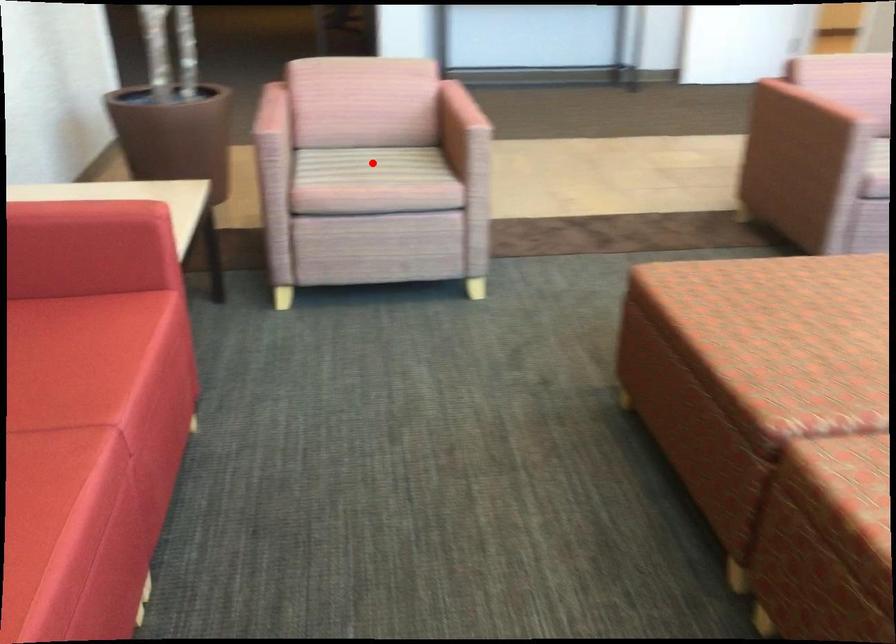
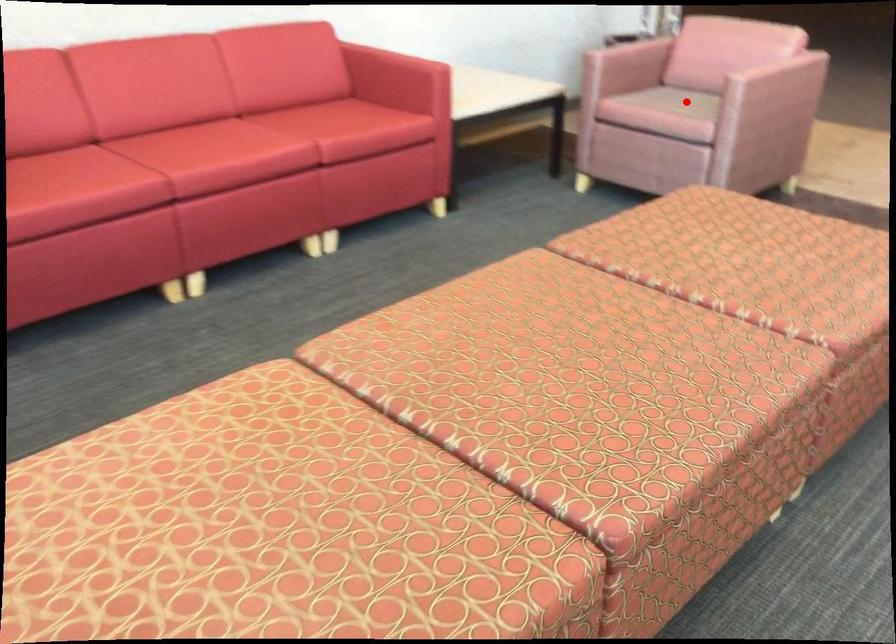
I am providing you with two images of the same scene from different viewpoints. A red point is marked on the first image and another point is marked on the second image. Does the point marked in image1 correspond to the same location as the one in image2?

Yes